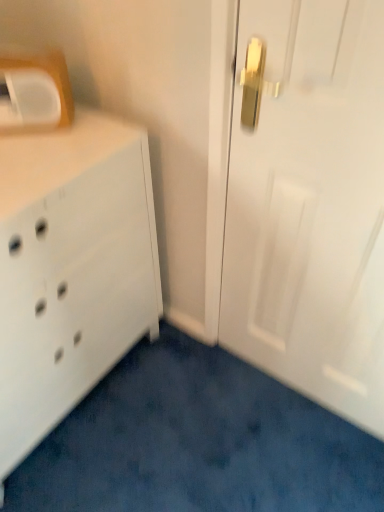
Question: Does point (44, 422) appear closer or farther from the camera than point (261, 96)?

Choices:
 (A) closer
 (B) farther

Answer: (B)

Question: Is white matte chest of drawers at left taller or shorter than white glossy door at center?

Choices:
 (A) tall
 (B) short

Answer: (B)

Question: Which is nearer to the white matte chest of drawers at left?

Choices:
 (A) white glossy door at center
 (B) white plastic medicine cabinet at upper left

Answer: (B)

Question: Which object is positioned farthest from the white plastic medicine cabinet at upper left?

Choices:
 (A) white matte chest of drawers at left
 (B) white glossy door at center

Answer: (B)